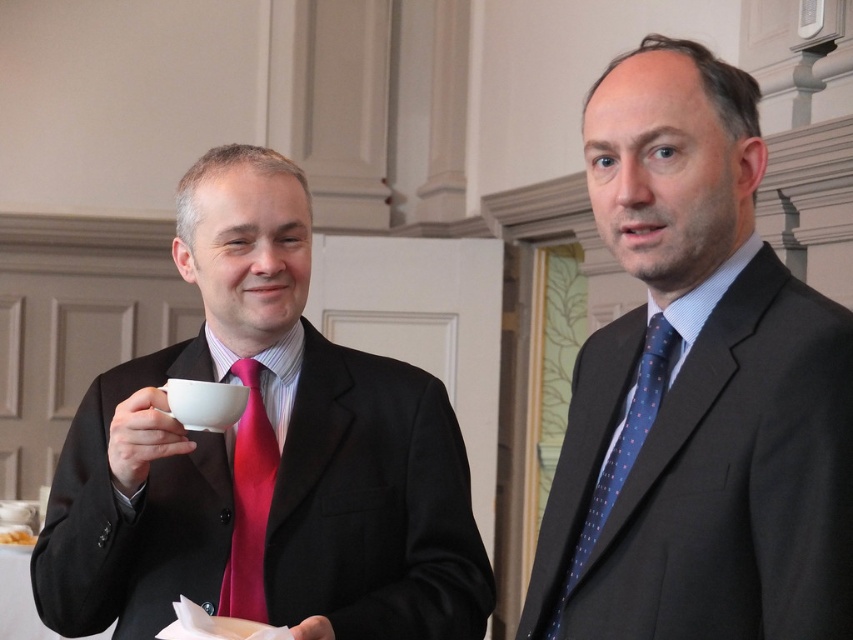
Question: Which object appears farthest from the camera in this image?

Choices:
 (A) matte black suit at right
 (B) matte pink tie at left
 (C) blue dotted fabric tie at right
 (D) matte black suit at left

Answer: (B)

Question: Which point is farther to the camera?

Choices:
 (A) pyautogui.click(x=245, y=499)
 (B) pyautogui.click(x=583, y=554)
 (C) pyautogui.click(x=802, y=385)
 (D) pyautogui.click(x=152, y=580)

Answer: (A)

Question: Does matte black suit at right appear on the left side of matte black suit at left?

Choices:
 (A) yes
 (B) no

Answer: (B)

Question: Which object is the farthest from the matte black suit at left?

Choices:
 (A) matte black suit at right
 (B) blue dotted fabric tie at right
 (C) matte pink tie at left

Answer: (B)

Question: Does matte black suit at right have a greater width compared to blue dotted fabric tie at right?

Choices:
 (A) no
 (B) yes

Answer: (B)

Question: Does matte black suit at left appear on the right side of blue dotted fabric tie at right?

Choices:
 (A) yes
 (B) no

Answer: (B)